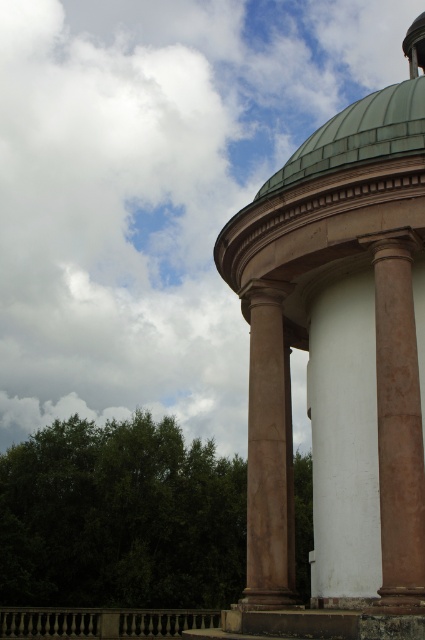
Question: Among these objects, which one is farthest from the camera?

Choices:
 (A) green leafy tree at lower left
 (B) brown marble column at center
 (C) green copper dome at upper right

Answer: (A)

Question: Does white smooth column at center appear over green copper dome at upper right?

Choices:
 (A) yes
 (B) no

Answer: (B)

Question: Is white fluffy cloud at upper left to the right of green copper dome at upper right from the viewer's perspective?

Choices:
 (A) no
 (B) yes

Answer: (A)

Question: Is white fluffy cloud at upper left further to the viewer compared to brown polished column at right?

Choices:
 (A) yes
 (B) no

Answer: (A)

Question: Which object is closer to the camera taking this photo?

Choices:
 (A) white fluffy cloud at upper left
 (B) brown marble column at center

Answer: (B)

Question: Estimate the real-world distances between objects in this image. Which object is farther from the green leafy tree at lower left?

Choices:
 (A) brown marble column at center
 (B) white fluffy cloud at upper left

Answer: (B)